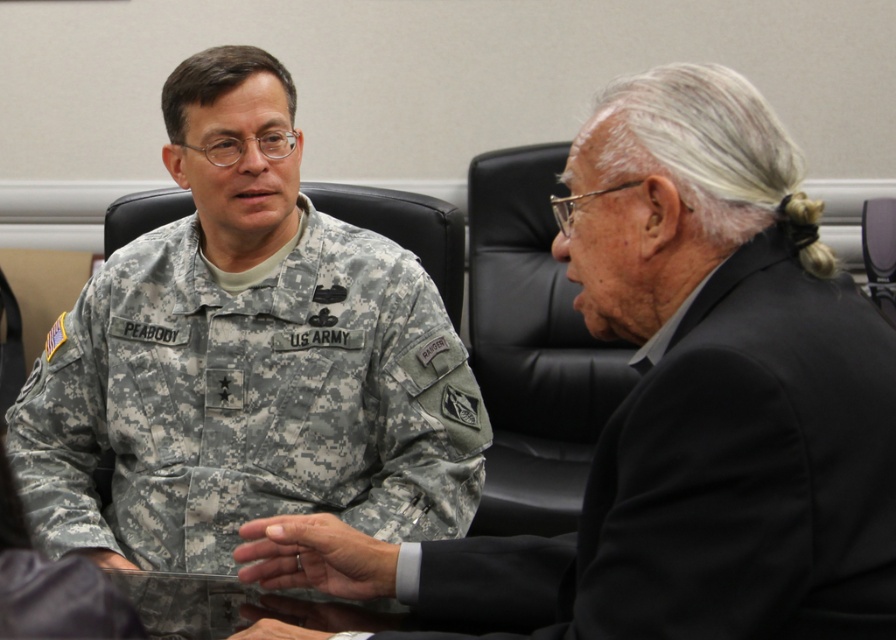
Does black matte suit at right have a greater width compared to matte black hand at center?

Indeed, black matte suit at right has a greater width compared to matte black hand at center.

Who is more forward, (461, 547) or (276, 620)?

Point (276, 620) is more forward.

At what (x,y) coordinates should I click in order to perform the action: click on black matte suit at right. Please return your answer as a coordinate pair (x, y). Looking at the image, I should click on (714, 483).

Where is `black matte suit at right`? This screenshot has width=896, height=640. black matte suit at right is located at coordinates (714, 483).

Between black matte suit at right and camouflage fabric at center, which one has less height?

Standing shorter between the two is camouflage fabric at center.

Does black matte suit at right appear on the right side of camouflage fabric at center?

Correct, you'll find black matte suit at right to the right of camouflage fabric at center.

At what (x,y) coordinates should I click in order to perform the action: click on black matte suit at right. Please return your answer as a coordinate pair (x, y). This screenshot has height=640, width=896. Looking at the image, I should click on (714, 483).

Between point (91, 477) and point (547, 566), which one is positioned behind?

The point (91, 477) is more distant.

Does point (235, 182) lie in front of point (450, 625)?

No, it is not.

I want to click on camouflage fabric uniform at center, so click(x=246, y=358).